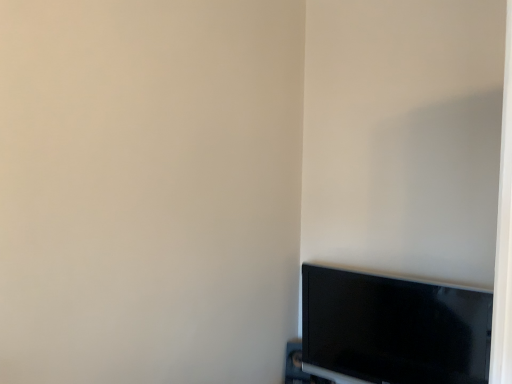
This screenshot has height=384, width=512. What do you see at coordinates (393, 329) in the screenshot? I see `black glossy tv at lower right` at bounding box center [393, 329].

Measure the distance between black glossy tv at lower right and camera.

The depth of black glossy tv at lower right is 4.20 feet.

Where is `black glossy tv at lower right`? The width and height of the screenshot is (512, 384). black glossy tv at lower right is located at coordinates (393, 329).

You are a GUI agent. You are given a task and a screenshot of the screen. Output one action in this format:
    pyautogui.click(x=<x>, y=<y>)
    Task: Click on the black glossy tv at lower right
    This screenshot has width=512, height=384.
    Given the screenshot: What is the action you would take?
    pyautogui.click(x=393, y=329)